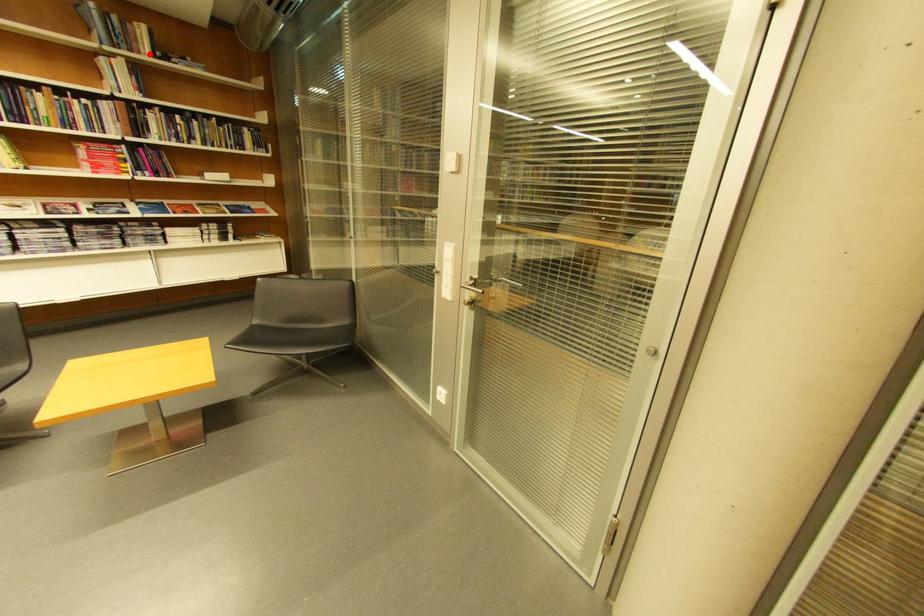
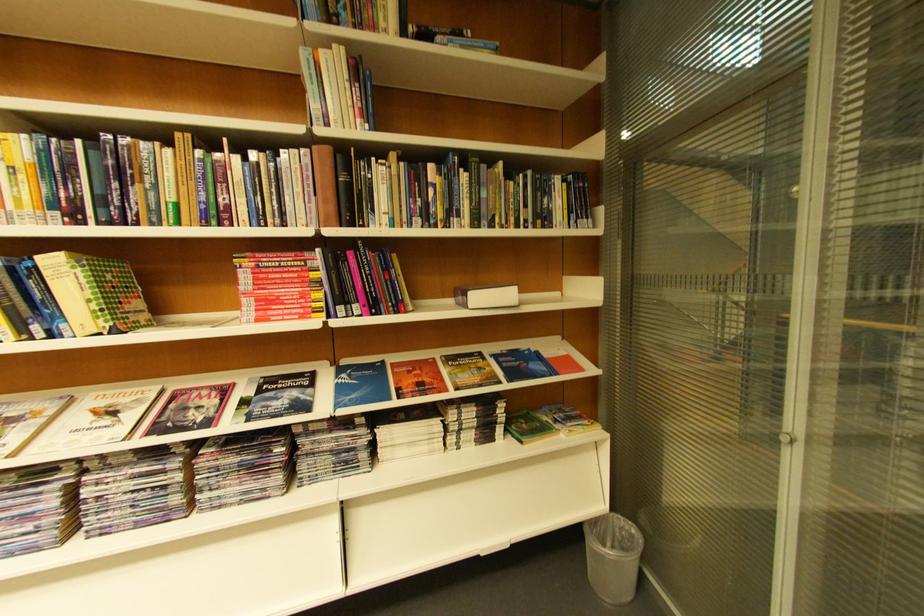
Find the pixel in the second image that matches the highlighted location in the first image.

(384, 31)